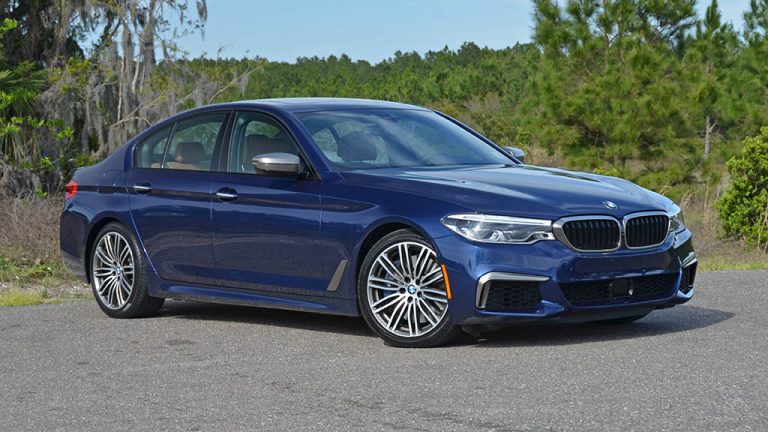
At what (x,y) coordinates should I click in order to perform the action: click on hood. Please return your answer as a coordinate pair (x, y). Looking at the image, I should click on (551, 186).